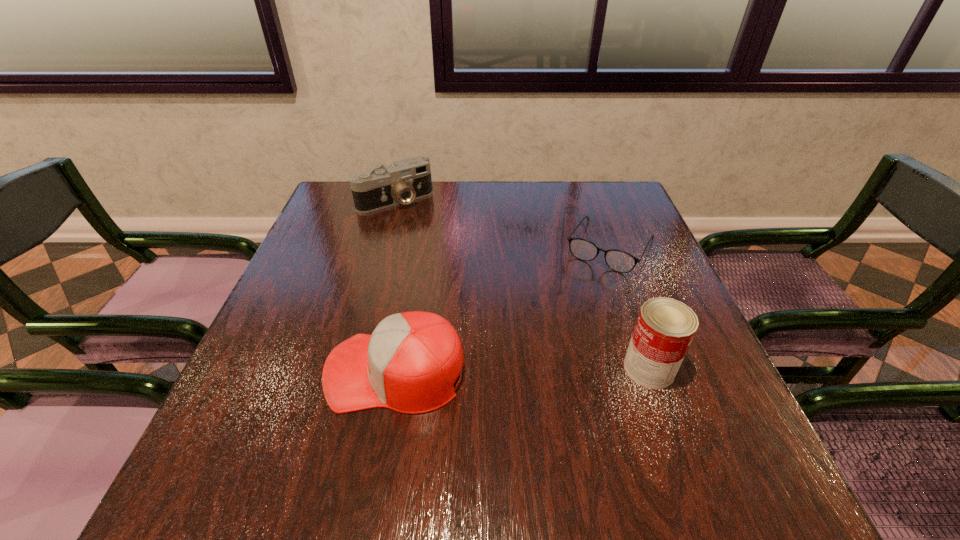
In order to click on can that is at the right edge in this screenshot , I will do `click(665, 327)`.

Find the location of a particular element. This screenshot has height=540, width=960. spectacles that is at the right edge is located at coordinates (620, 261).

The height and width of the screenshot is (540, 960). I want to click on object present at the far left corner, so click(406, 180).

This screenshot has width=960, height=540. In order to click on object at the near left corner in this screenshot , I will do `click(409, 364)`.

Identify the location of object located in the far right corner section of the desktop. Image resolution: width=960 pixels, height=540 pixels. (620, 261).

Where is `vacant area at the far edge`? vacant area at the far edge is located at coordinates [422, 207].

Find the location of a particular element. This screenshot has width=960, height=540. vacant space at the near edge of the desktop is located at coordinates (629, 417).

Locate an element on the screen. This screenshot has height=540, width=960. free space at the left edge of the desktop is located at coordinates coord(325,237).

Find the location of a particular element. blank space at the near left corner of the desktop is located at coordinates (235, 423).

The image size is (960, 540). I want to click on free space at the far right corner of the desktop, so click(636, 217).